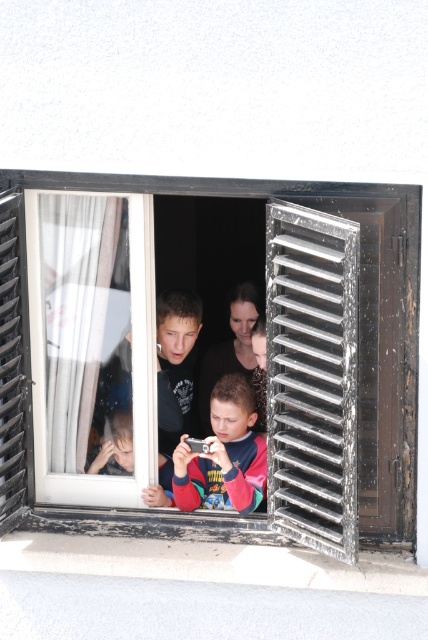
Question: Does multicolored fabric shirt at center have a larger size compared to wooden textured shutter at left?

Choices:
 (A) no
 (B) yes

Answer: (B)

Question: Is black matte window at center closer to camera compared to metallic silver shutter at center?

Choices:
 (A) no
 (B) yes

Answer: (A)

Question: Is black matte window at center further to the viewer compared to white sheer curtain at center?

Choices:
 (A) yes
 (B) no

Answer: (B)

Question: Which point is closer to the camera?

Choices:
 (A) white sheer curtain at center
 (B) black matte window at center
 (C) metallic silver shutter at center

Answer: (C)

Question: Which of the following is the closest to the observer?

Choices:
 (A) multicolored fabric shirt at center
 (B) wooden textured shutter at left

Answer: (B)

Question: Among these objects, which one is nearest to the camera?

Choices:
 (A) metallic silver shutter at center
 (B) black matte window at center

Answer: (A)